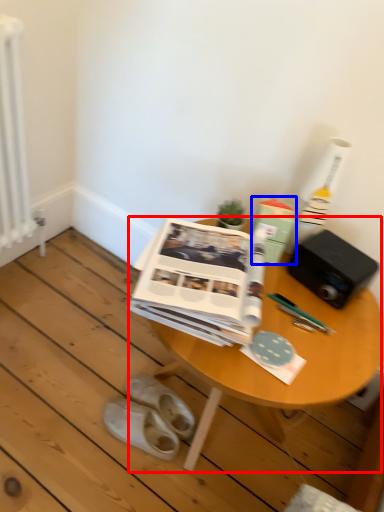
Question: Which object is further to the camera taking this photo, table (highlighted by a red box) or paperback book (highlighted by a blue box)?

Choices:
 (A) table
 (B) paperback book

Answer: (B)